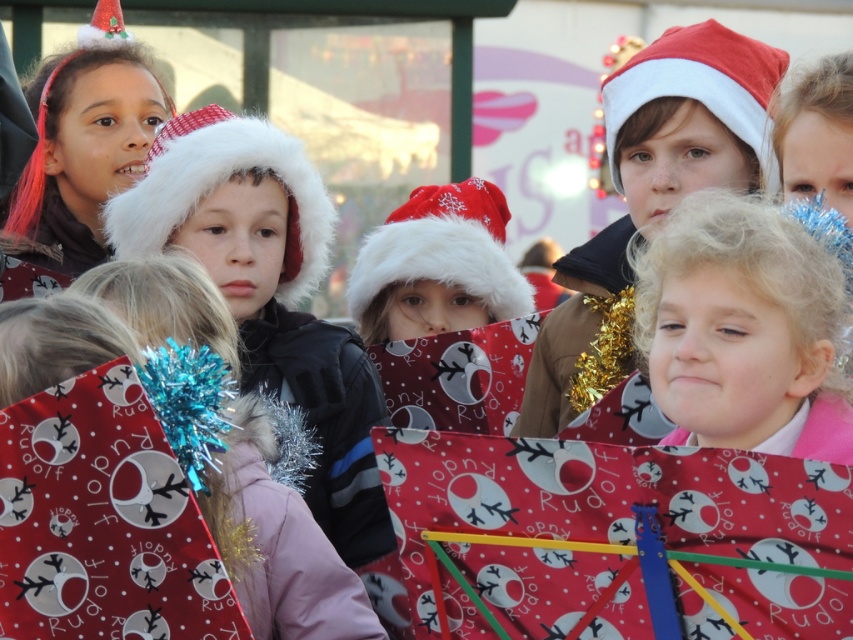
You are organizing a Christmas parade and need to place two Santa hats on a float. The float has a limited space between them. Given the image, can you determine if the distance between the white fluffy Santa hat at center and the red fluffy Santa hat at center is more than 10 feet?

The distance between the white fluffy Santa hat at center and the red fluffy Santa hat at center is 13.24 feet, which is more than 10 feet, so yes, the distance is more than 10 feet.

Looking at the children in the festive scene, which object has a smaller width between the blonde curly hair at center and the white fluffy santa hat at center?

The blonde curly hair at center has a smaller width than the white fluffy santa hat at center.